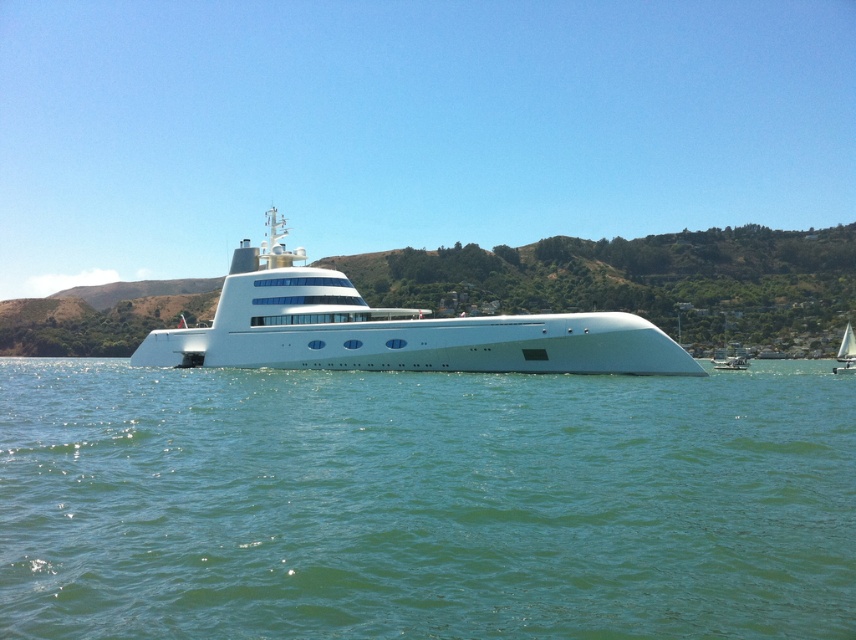
Question: Which object is the closest to the clear blue water at center?

Choices:
 (A) white glossy sailboat at lower right
 (B) white glossy cruise ship at center

Answer: (B)

Question: Which object is farther from the camera taking this photo?

Choices:
 (A) clear blue water at center
 (B) white glossy sailboat at lower right
 (C) white glossy cruise ship at center

Answer: (B)

Question: Can you confirm if clear blue water at center is thinner than white glossy sailboat at lower right?

Choices:
 (A) no
 (B) yes

Answer: (A)

Question: Is white glossy cruise ship at center to the right of white glossy sailboat at lower right from the viewer's perspective?

Choices:
 (A) yes
 (B) no

Answer: (B)

Question: Which of these objects is positioned closest to the white glossy cruise ship at center?

Choices:
 (A) clear blue water at center
 (B) white glossy sailboat at lower right

Answer: (A)

Question: Is clear blue water at center above white glossy sailboat at lower right?

Choices:
 (A) yes
 (B) no

Answer: (B)